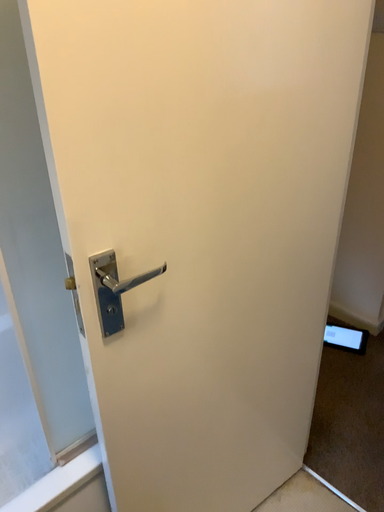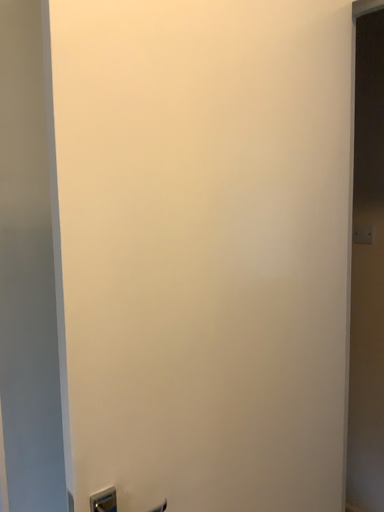
Question: How did the camera likely rotate when shooting the video?

Choices:
 (A) rotated downward
 (B) rotated upward

Answer: (B)